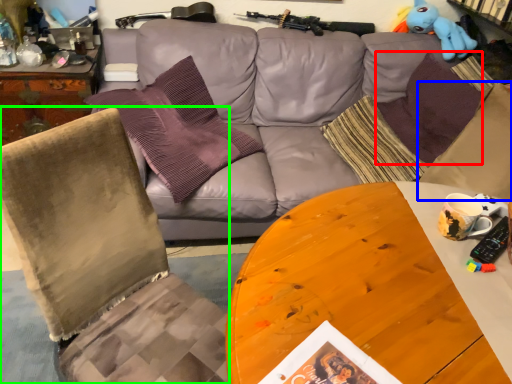
Question: Estimate the real-world distances between objects in this image. Which object is closer to pillow (highlighted by a red box), pillow (highlighted by a blue box) or chair (highlighted by a green box)?

Choices:
 (A) pillow
 (B) chair

Answer: (A)